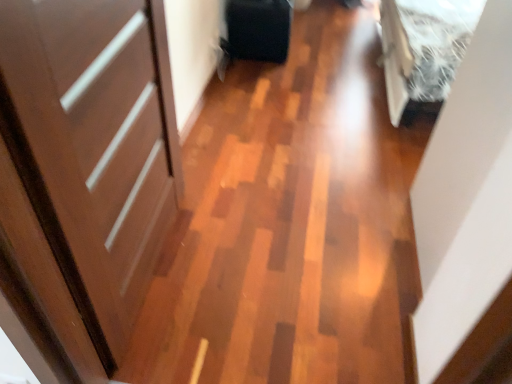
The width and height of the screenshot is (512, 384). Identify the location of free location in front of matte black suitcase at center. (266, 70).